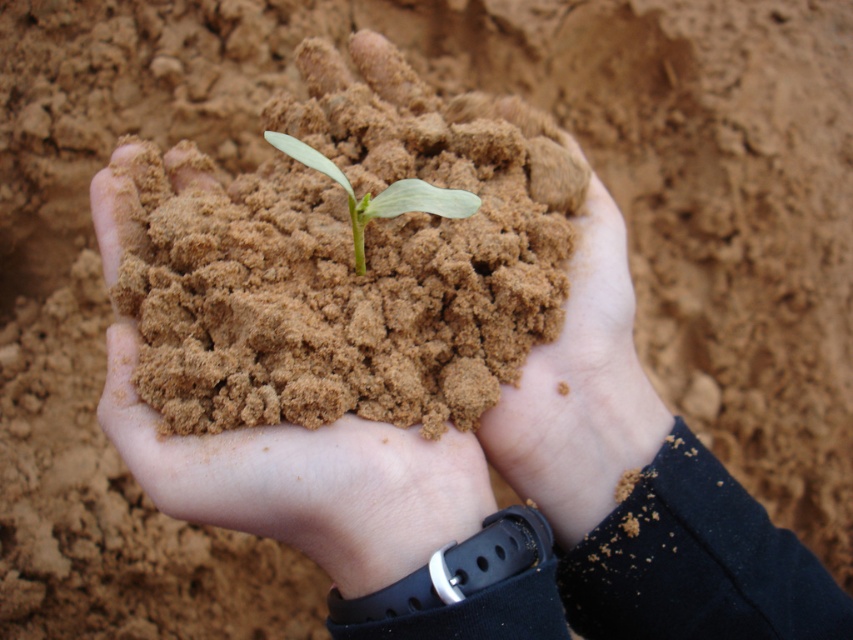
Question: Observing the image, what is the correct spatial positioning of brown sandy soil at center in reference to green matte plant at center?

Choices:
 (A) below
 (B) above

Answer: (B)

Question: Which point appears closest to the camera in this image?

Choices:
 (A) coord(450,216)
 (B) coord(555,307)

Answer: (A)

Question: Which point is farther to the camera?

Choices:
 (A) green matte plant at center
 (B) brown sandy soil at center

Answer: (B)

Question: Which point is closer to the camera?

Choices:
 (A) (367, 196)
 (B) (489, 241)

Answer: (A)

Question: Does brown sandy soil at center appear over green matte plant at center?

Choices:
 (A) no
 (B) yes

Answer: (B)

Question: Is brown sandy soil at center bigger than green matte plant at center?

Choices:
 (A) yes
 (B) no

Answer: (A)